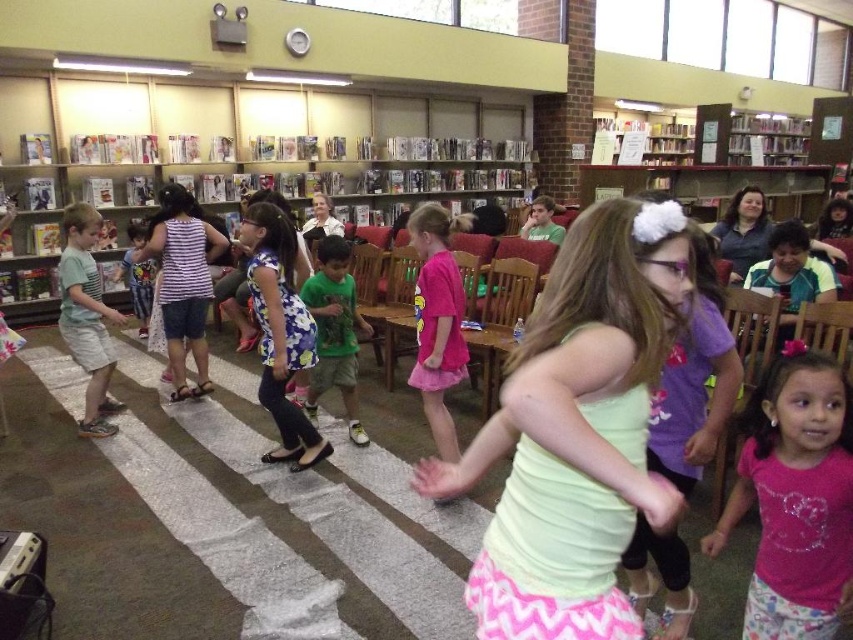
You are organizing a small event in the library and need to place a decorative item on the light green jersey at center. However, you also need to ensure that the wooden chair at right doesn

The light green jersey at center has a smaller size compared to the wooden chair at right. Since the jersey is smaller, you can place the decorative item on it without affecting the chair.